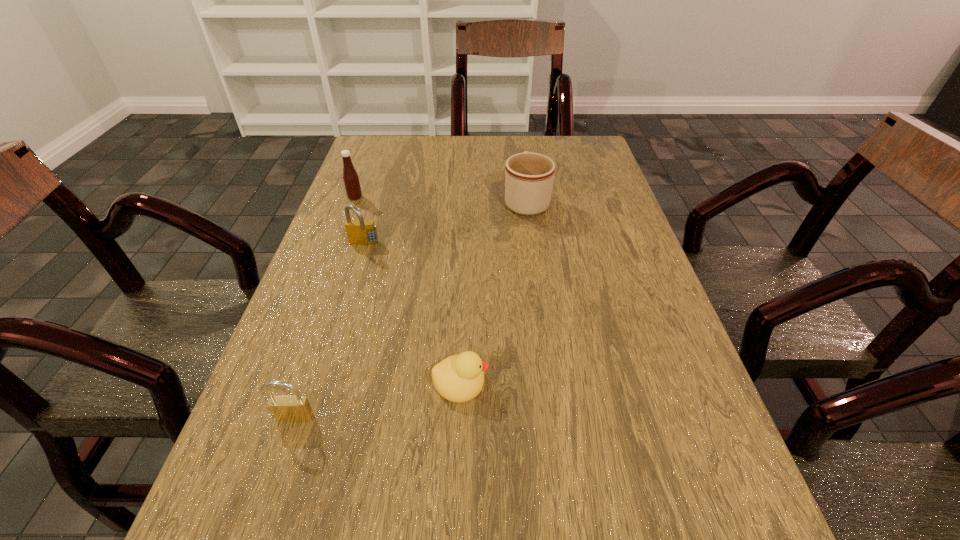
Identify the location of empty space between the nearest object and the shortest object. (378, 400).

Image resolution: width=960 pixels, height=540 pixels. What are the coordinates of `empty location between the Tabasco sauce and the nearer padlock` in the screenshot? It's located at (325, 308).

The image size is (960, 540). What are the coordinates of `vacant point located between the nearest object and the shortest object` in the screenshot? It's located at (378, 400).

Locate an element on the screen. The width and height of the screenshot is (960, 540). vacant point located between the rightmost object and the third nearest object is located at coordinates (445, 223).

Where is `free space between the mug and the nearer padlock`? free space between the mug and the nearer padlock is located at coordinates (411, 309).

Image resolution: width=960 pixels, height=540 pixels. Identify the location of vacant area that lies between the second object from right to left and the farther padlock. (412, 314).

This screenshot has height=540, width=960. What are the coordinates of `free spot between the nearest object and the mug` in the screenshot? It's located at (411, 309).

Select which object appears as the closest to the rightmost object. Please provide its 2D coordinates. Your answer should be formatted as a tuple, i.e. [(x, y)], where the tuple contains the x and y coordinates of a point satisfying the conditions above.

[(360, 232)]

Locate an element on the screen. The width and height of the screenshot is (960, 540). object that is the fourth closest one to the rightmost object is located at coordinates (296, 408).